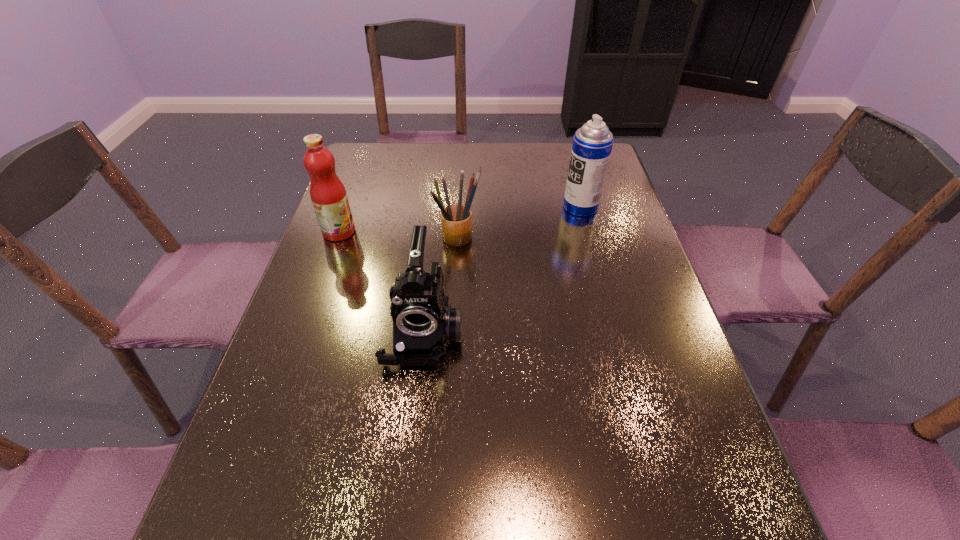
I want to click on vacant space located on the front of the pencil box, so click(x=454, y=342).

Where is `object present at the left edge`? The image size is (960, 540). object present at the left edge is located at coordinates (328, 195).

Find the location of a particular element. object located at the right edge is located at coordinates (592, 144).

Where is `vacant space at the far edge`? Image resolution: width=960 pixels, height=540 pixels. vacant space at the far edge is located at coordinates (555, 171).

In the image, there is a desktop. Where is `free space at the left edge`? free space at the left edge is located at coordinates (323, 315).

This screenshot has width=960, height=540. I want to click on free space at the right edge of the desktop, so click(x=645, y=256).

The width and height of the screenshot is (960, 540). In order to click on free point at the far left corner in this screenshot , I will do tap(366, 145).

The height and width of the screenshot is (540, 960). Identify the location of free spot between the pencil box and the rightmost object. (520, 222).

Where is `vacant space that is in between the camcorder and the leftmost object`? The height and width of the screenshot is (540, 960). vacant space that is in between the camcorder and the leftmost object is located at coordinates (381, 283).

At what (x,y) coordinates should I click in order to perform the action: click on vacant space in between the pencil box and the fruit juice. Please return your answer as a coordinate pair (x, y). Looking at the image, I should click on (399, 235).